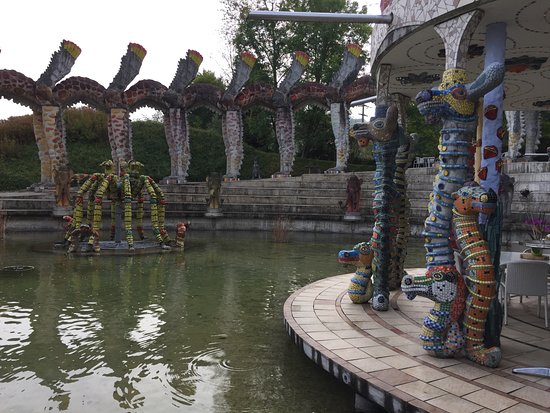
Where is `edge of floor`? The image size is (550, 413). edge of floor is located at coordinates (297, 329), (289, 316).